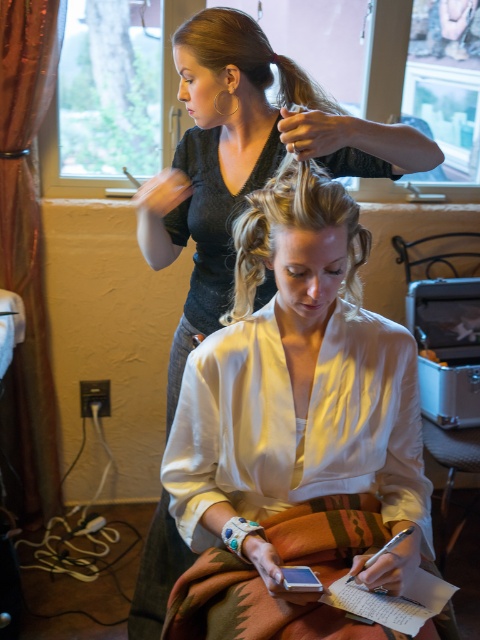
Question: Estimate the real-world distances between objects in this image. Which object is farther from the blonde hair at upper center?

Choices:
 (A) blonde silky hair at center
 (B) camouflage fabric robe at center

Answer: (A)

Question: Which object is farther from the camera taking this photo?

Choices:
 (A) blonde hair at upper center
 (B) blonde silky hair at center

Answer: (A)

Question: Is camouflage fabric robe at center thinner than blonde silky hair at center?

Choices:
 (A) yes
 (B) no

Answer: (B)

Question: Can you confirm if blonde silky hair at center is positioned above blonde hair at upper center?

Choices:
 (A) yes
 (B) no

Answer: (B)

Question: Can you confirm if camouflage fabric robe at center is smaller than blonde silky hair at center?

Choices:
 (A) no
 (B) yes

Answer: (A)

Question: Estimate the real-world distances between objects in this image. Which object is closer to the blonde silky hair at center?

Choices:
 (A) camouflage fabric robe at center
 (B) blonde hair at upper center

Answer: (A)